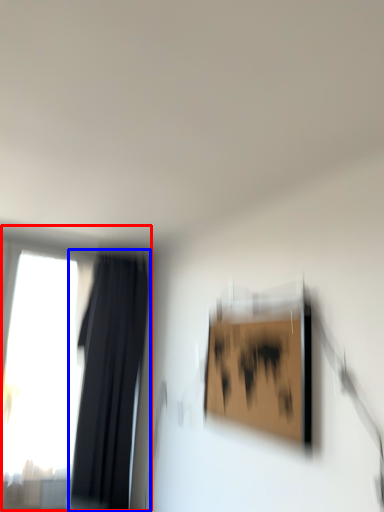
Question: Which of the following is the closest to the observer, window (highlighted by a red box) or curtain (highlighted by a blue box)?

Choices:
 (A) window
 (B) curtain

Answer: (B)